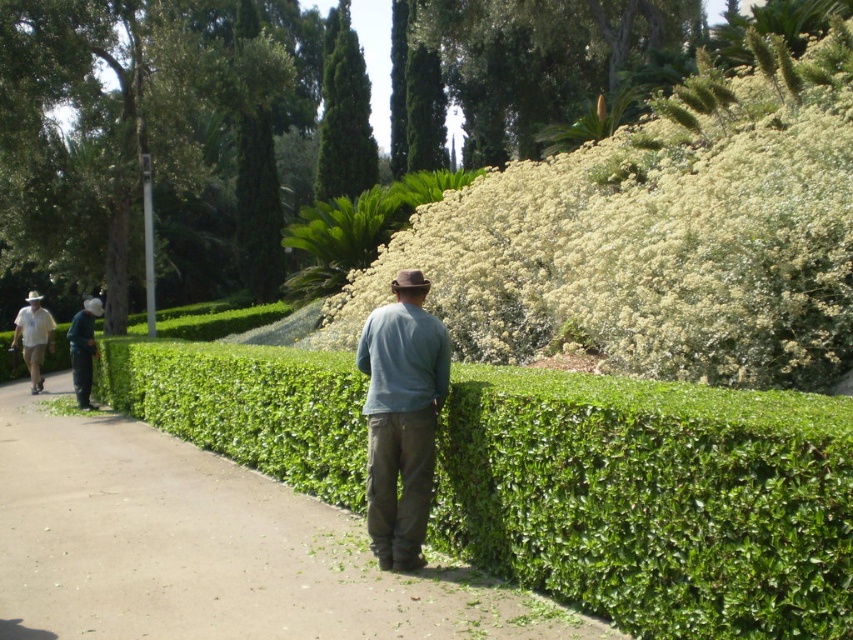
Based on the photo, who is taller, white fluffy bush at upper right or green leafy tree at upper center?

With more height is green leafy tree at upper center.

Does point (740, 244) come farther from viewer compared to point (109, 236)?

No, it is in front of (109, 236).

Where is `white fluffy bush at upper right`? white fluffy bush at upper right is located at coordinates (648, 252).

Between white fluffy bush at upper right and dark blue jeans at left, which one has less height?

Standing shorter between the two is white fluffy bush at upper right.

Between white fluffy bush at upper right and dark blue jeans at left, which one appears on the left side from the viewer's perspective?

dark blue jeans at left

What do you see at coordinates (648, 252) in the screenshot? The width and height of the screenshot is (853, 640). I see `white fluffy bush at upper right` at bounding box center [648, 252].

The image size is (853, 640). Find the location of `white fluffy bush at upper right`. white fluffy bush at upper right is located at coordinates (648, 252).

Which is more to the right, teal cotton shirt at center or light blue shirt at left?

teal cotton shirt at center is more to the right.

Does point (380, 490) come farther from viewer compared to point (35, 326)?

That is False.

Where is `teal cotton shirt at center`? The height and width of the screenshot is (640, 853). teal cotton shirt at center is located at coordinates (401, 417).